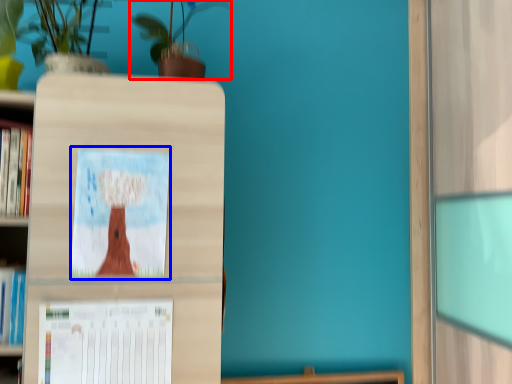
Question: Which of the following is the farthest to the observer, houseplant (highlighted by a red box) or picture frame (highlighted by a blue box)?

Choices:
 (A) houseplant
 (B) picture frame

Answer: (A)